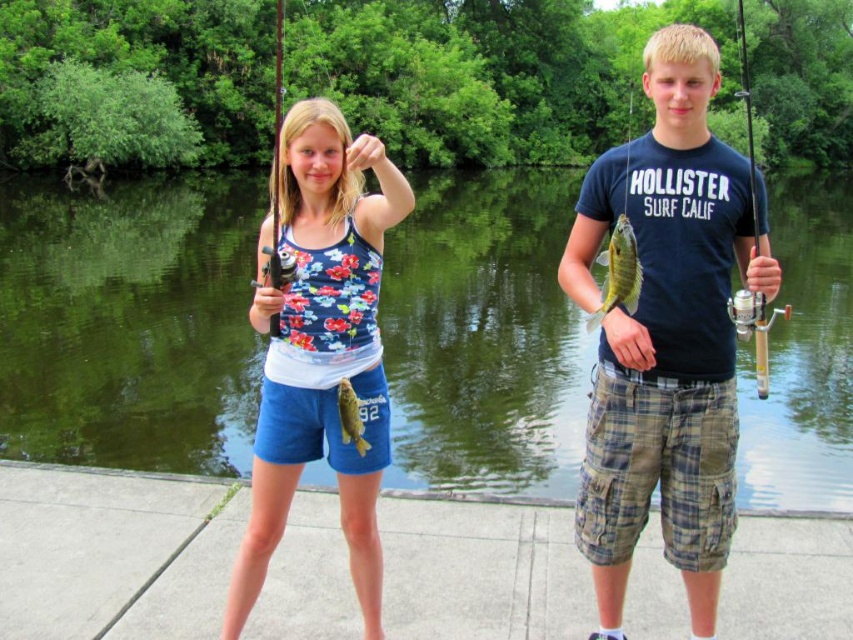
Question: Which of the following is the closest to the observer?

Choices:
 (A) wooden spinning reel at right
 (B) shiny green fish at center
 (C) green smooth water at center
 (D) matte black fishing pole at left

Answer: (A)

Question: Does wooden spinning reel at right have a smaller size compared to shiny green fish at center?

Choices:
 (A) no
 (B) yes

Answer: (A)

Question: Is wooden spinning reel at right thinner than shiny green fish at center?

Choices:
 (A) yes
 (B) no

Answer: (B)

Question: Based on their relative distances, which object is nearer to the green shiny fish at center?

Choices:
 (A) matte black shirt at center
 (B) matte black fishing pole at left
 (C) wooden spinning reel at right
 (D) floral fabric tank top at center

Answer: (A)

Question: Which object is the closest to the floral fabric tank top at center?

Choices:
 (A) wooden spinning reel at right
 (B) matte black shirt at center

Answer: (B)

Question: Is green smooth water at center thinner than shiny green fish at center?

Choices:
 (A) no
 (B) yes

Answer: (A)